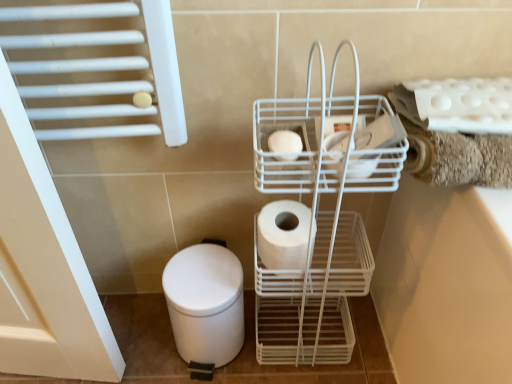
Question: From a real-world perspective, is white matte toilet paper at center, which is counted as the 2th toilet paper, starting from the front, physically located above or below white matte bidet at lower left?

Choices:
 (A) below
 (B) above

Answer: (B)

Question: From the image's perspective, relative to white matte bidet at lower left, is white matte toilet paper at center, the 1th toilet paper in the bottom-to-top sequence, above or below?

Choices:
 (A) below
 (B) above

Answer: (B)

Question: Estimate the real-world distances between objects in this image. Which object is closer to the white matte bidet at lower left?

Choices:
 (A) white matte toilet paper at center, which is counted as the 2th toilet paper, starting from the front
 (B) white wire trolley at center
 (C) white matte toilet paper at center, which ranks as the second toilet paper in back-to-front order

Answer: (A)

Question: Considering the real-world distances, which object is farthest from the white wire trolley at center?

Choices:
 (A) white matte toilet paper at center, which is the 2th toilet paper in bottom-to-top order
 (B) white matte toilet paper at center, the 1th toilet paper in the bottom-to-top sequence
 (C) white matte bidet at lower left

Answer: (A)